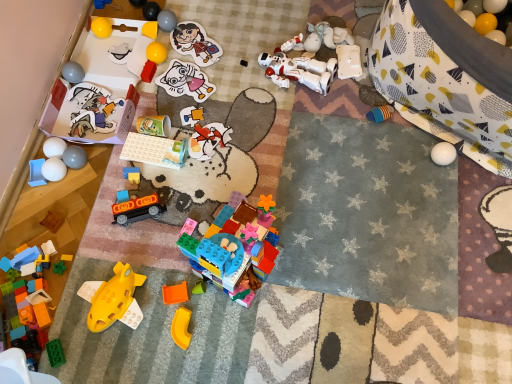
Where is `vacant area that lies between matte paper sticker at upper center, which is counted as the twentieth toy, starting from the left, and yellow matte plastic arch at center, which appears as the 21th toy when viewed from the left`? vacant area that lies between matte paper sticker at upper center, which is counted as the twentieth toy, starting from the left, and yellow matte plastic arch at center, which appears as the 21th toy when viewed from the left is located at coordinates (192, 148).